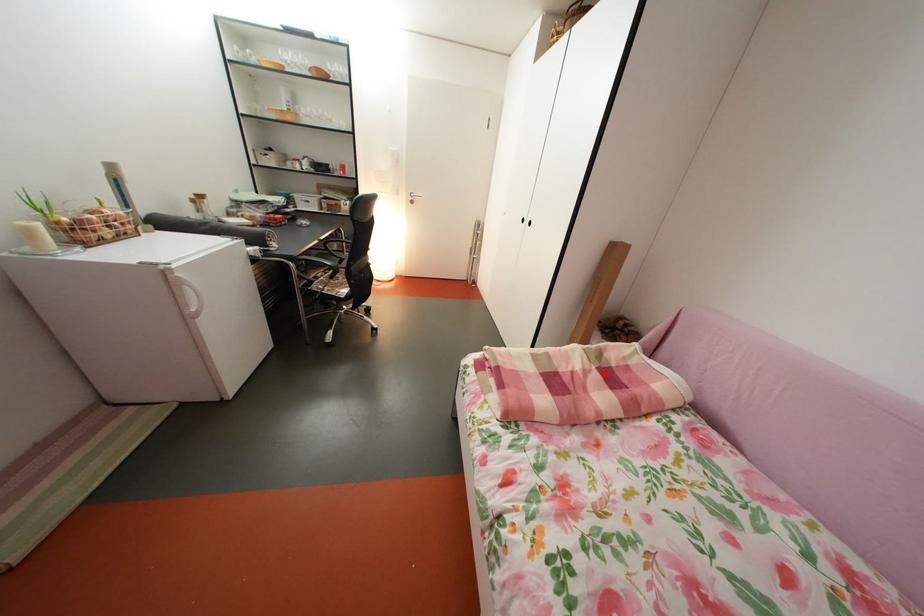
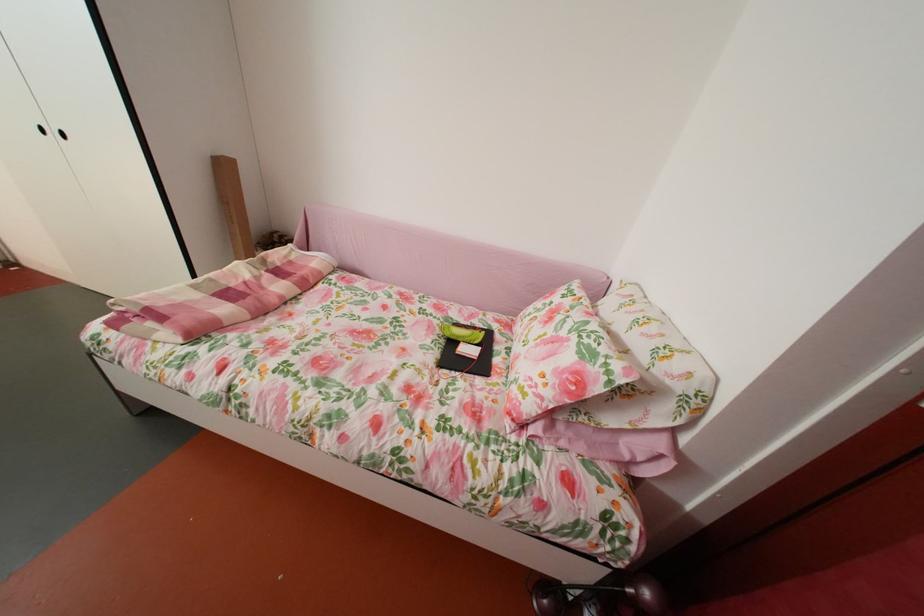
The point at the highlighted location is marked in the first image. Where is the corresponding point in the second image?

(274, 278)